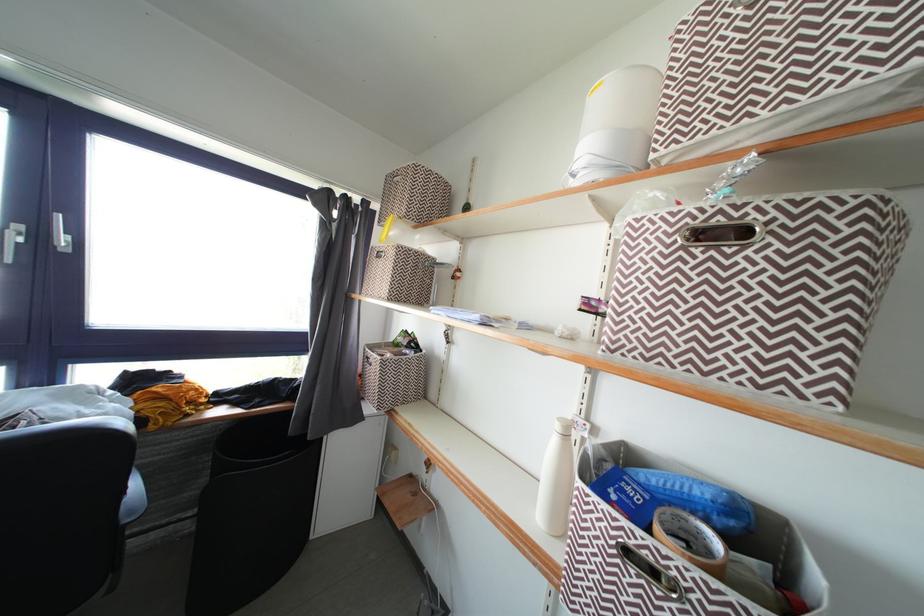
I want to click on blue zippered pouch, so click(673, 498).